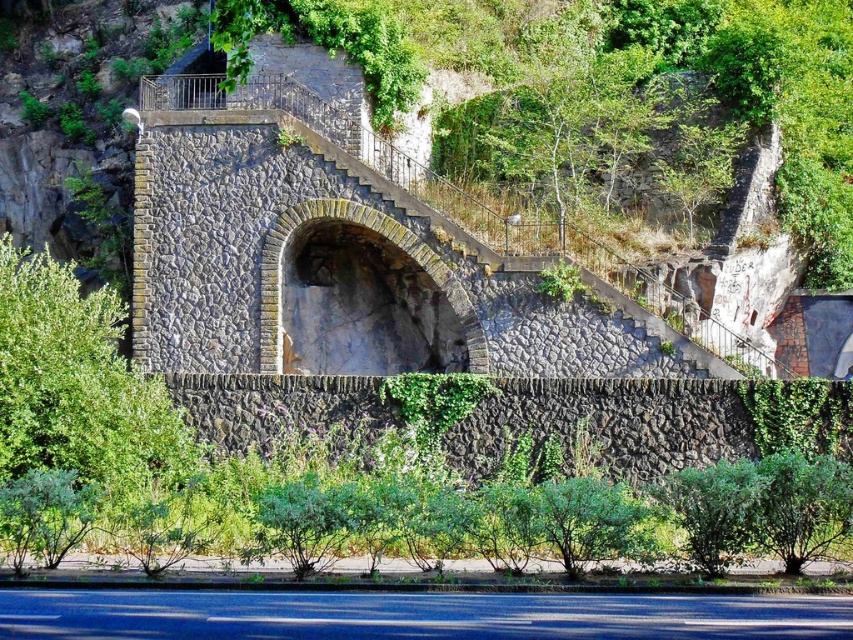
You are standing in front of the stone structure and notice two green leafy bushes. One is labeled as the green leafy bush at lower left and the other as the green leafy bush at lower right. Which of these bushes is positioned to the left when viewed from your perspective?

The green leafy bush at lower left is positioned to the left of the green leafy bush at lower right, so from your perspective, the green leafy bush at lower left is on the left side.